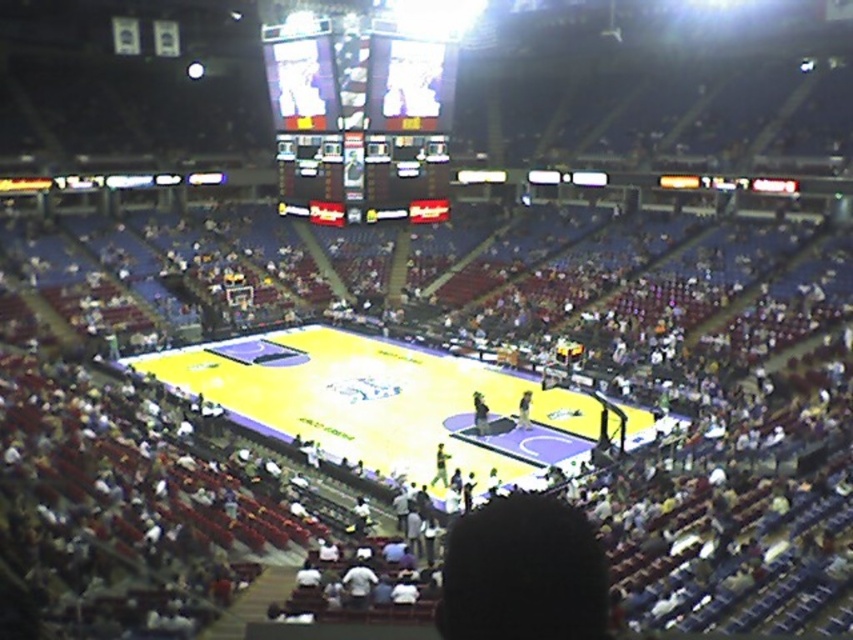
Question: Based on their relative distances, which object is nearer to the shiny digital display at upper center?

Choices:
 (A) yellow polished wood court at center
 (B) black glossy scoreboard at center

Answer: (B)

Question: Which point is farther to the camera?

Choices:
 (A) (247, 416)
 (B) (393, 212)
 (C) (339, 160)

Answer: (A)

Question: Does shiny digital display at upper center have a smaller size compared to black glossy scoreboard at center?

Choices:
 (A) no
 (B) yes

Answer: (A)

Question: Observing the image, what is the correct spatial positioning of yellow polished wood court at center in reference to black glossy scoreboard at center?

Choices:
 (A) left
 (B) right

Answer: (A)

Question: Which point is farther to the camera?

Choices:
 (A) (422, 195)
 (B) (386, 461)
 (C) (350, 157)

Answer: (A)

Question: Observing the image, what is the correct spatial positioning of shiny digital display at upper center in reference to black glossy scoreboard at center?

Choices:
 (A) above
 (B) below

Answer: (A)